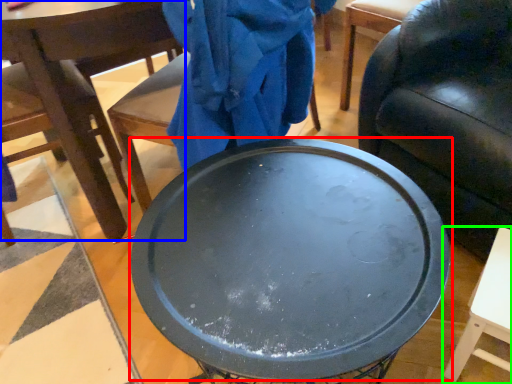
Question: Which object is the closest to the round table (highlighted by a red box)? Choose among these: chair (highlighted by a blue box) or table (highlighted by a green box).

Choices:
 (A) chair
 (B) table

Answer: (B)